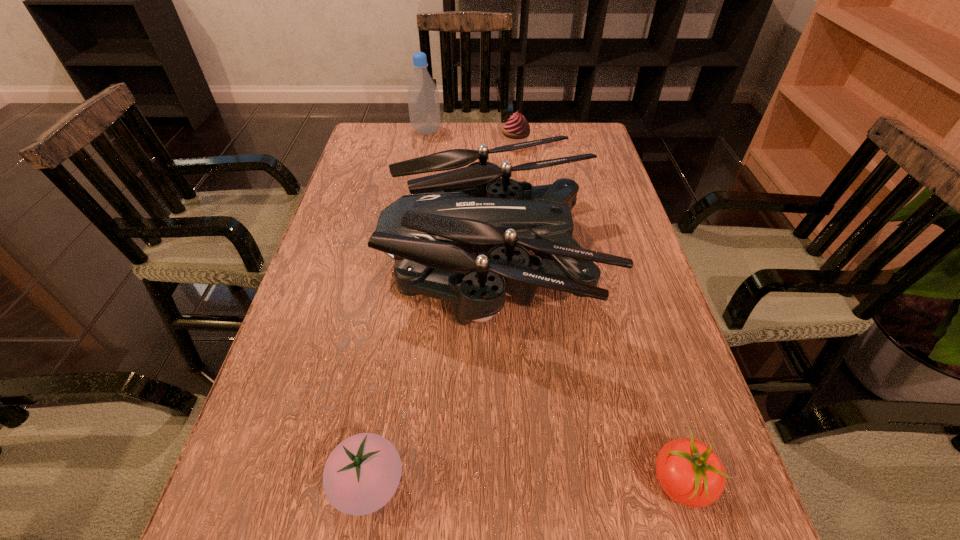
In order to click on vacant position located on the right of the left tomato in this screenshot , I will do `click(445, 484)`.

This screenshot has width=960, height=540. I want to click on vacant point located 0.170m on the left of the right tomato, so click(536, 482).

The image size is (960, 540). Find the location of `bottle that is at the far edge`. bottle that is at the far edge is located at coordinates [x=423, y=96].

Locate an element on the screen. cupcake at the far edge is located at coordinates (516, 130).

At what (x,y) coordinates should I click in order to perform the action: click on bottle that is positioned at the left edge. Please return your answer as a coordinate pair (x, y). The width and height of the screenshot is (960, 540). Looking at the image, I should click on (423, 96).

The width and height of the screenshot is (960, 540). Identify the location of drone that is at the left edge. (449, 215).

Find the location of a particular element. The width and height of the screenshot is (960, 540). tomato that is at the left edge is located at coordinates (361, 475).

Identify the location of drone that is at the right edge. The height and width of the screenshot is (540, 960). (449, 215).

The width and height of the screenshot is (960, 540). Identify the location of tomato positioned at the right edge. (690, 473).

This screenshot has height=540, width=960. What are the coordinates of `object that is at the far left corner` in the screenshot? It's located at pyautogui.click(x=423, y=96).